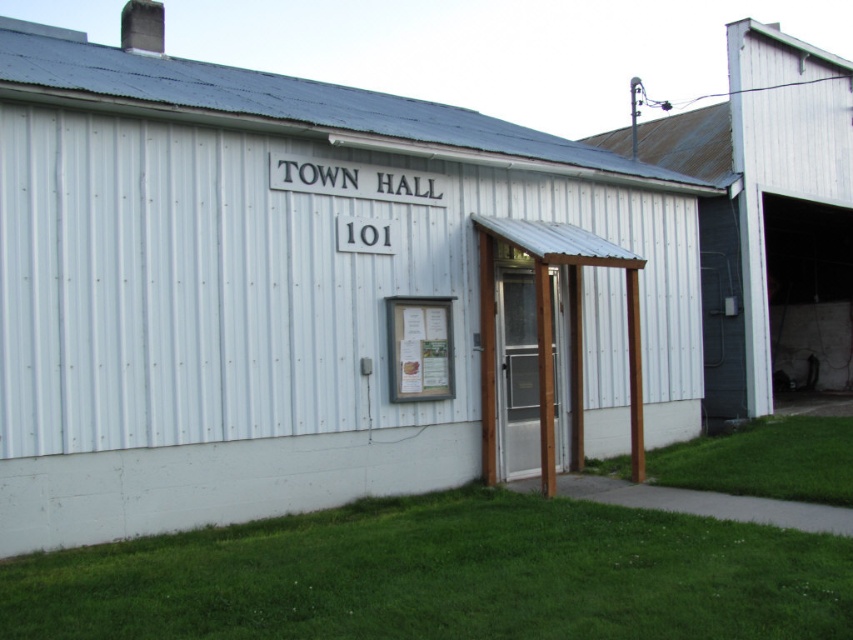
Is white corrugated metal barn at right thinner than green grass at lower right?

No.

Which of these two, white corrugated metal barn at right or green grass at lower right, stands taller?

With more height is white corrugated metal barn at right.

Is point (824, 378) closer to viewer compared to point (845, 424)?

No, it is behind (845, 424).

Where is `white corrugated metal barn at right`? white corrugated metal barn at right is located at coordinates (770, 218).

Does green grass at lower center have a smaller size compared to green grass at lower right?

Indeed, green grass at lower center has a smaller size compared to green grass at lower right.

From the picture: Does green grass at lower center have a greater height compared to green grass at lower right?

Incorrect, green grass at lower center's height is not larger of green grass at lower right's.

Does point (454, 548) come behind point (628, 467)?

No.

You are a GUI agent. You are given a task and a screenshot of the screen. Output one action in this format:
    pyautogui.click(x=<x>, y=<y>)
    Task: Click on the green grass at lower center
    The image size is (853, 640).
    Given the screenshot: What is the action you would take?
    pyautogui.click(x=444, y=577)

Is point (53, 593) closer to viewer compared to point (775, 202)?

Yes, it is.

Is the position of green grass at lower center less distant than that of white corrugated metal barn at right?

Yes, green grass at lower center is in front of white corrugated metal barn at right.

Locate an element on the screen. This screenshot has height=640, width=853. green grass at lower center is located at coordinates (444, 577).